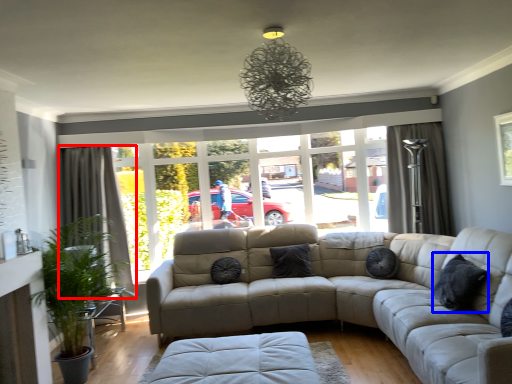
Question: Which object is further to the camera taking this photo, curtain (highlighted by a red box) or pillow (highlighted by a blue box)?

Choices:
 (A) curtain
 (B) pillow

Answer: (A)